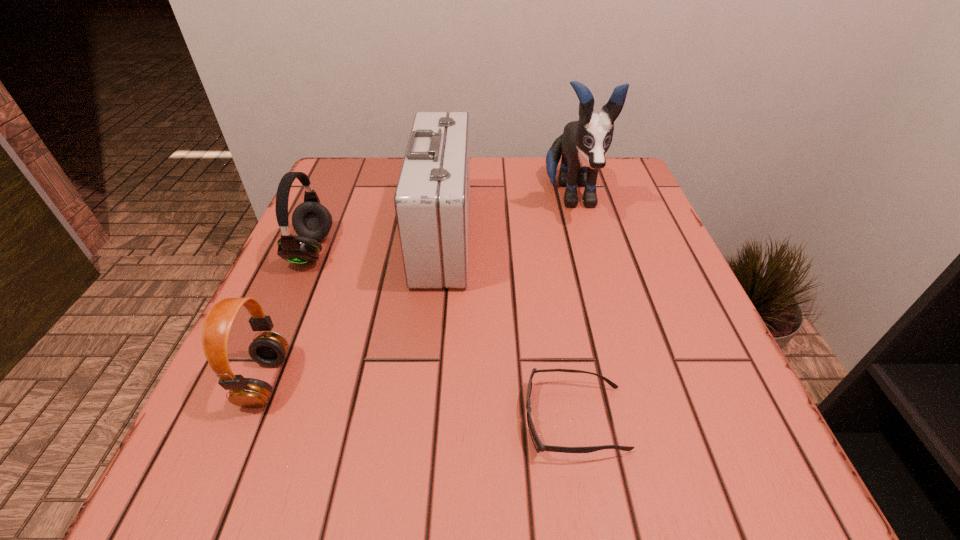
I want to click on vacant position in the image that satisfies the following two spatial constraints: 1. on the front-facing side of the puppy; 2. on the ear cups of the nearer headset, so click(622, 381).